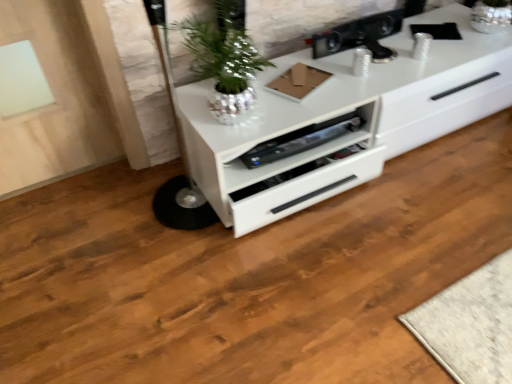
This screenshot has height=384, width=512. I want to click on vacant space in between shiny metallic plant at center and metallic black speaker at upper center, the second appliance when ordered from bottom to top, so click(x=315, y=81).